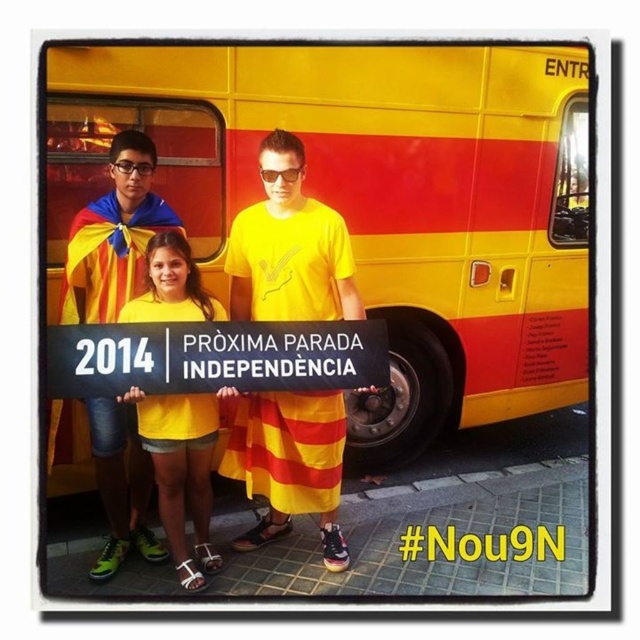
You are a photographer holding a camera. You want to take a photo of the yellow matte bus at center from your current position. The bus is part of a demonstration with people holding signs. Is the distance between you and the bus sufficient to capture the entire bus in one frame without moving closer?

The yellow matte bus at center and camera are 2.78 meters apart from each other. This distance may be sufficient to capture the entire bus in one frame, depending on the camera lens used. A standard lens might require being closer, while a wide angle lens could capture the entire bus from 2.78 meters away.